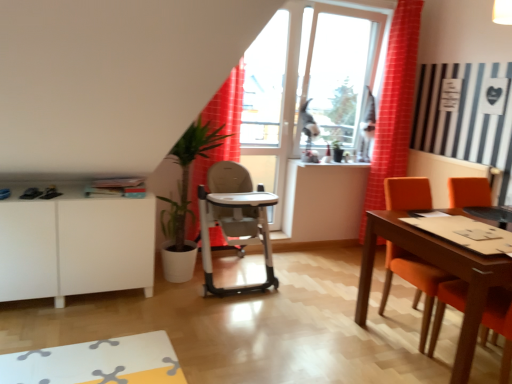
Find the location of a particular element. vacant space to the right of silver metallic highchair at center is located at coordinates (311, 278).